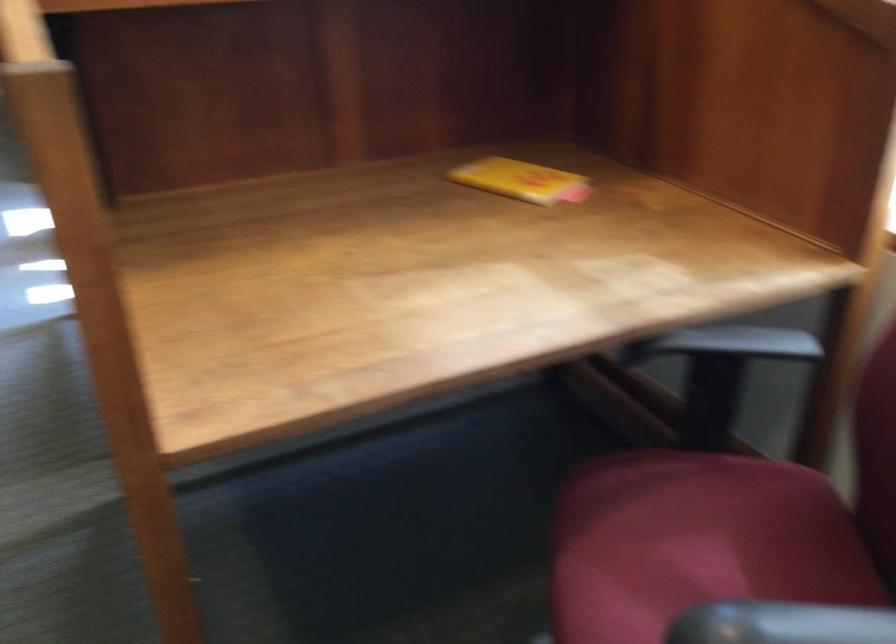
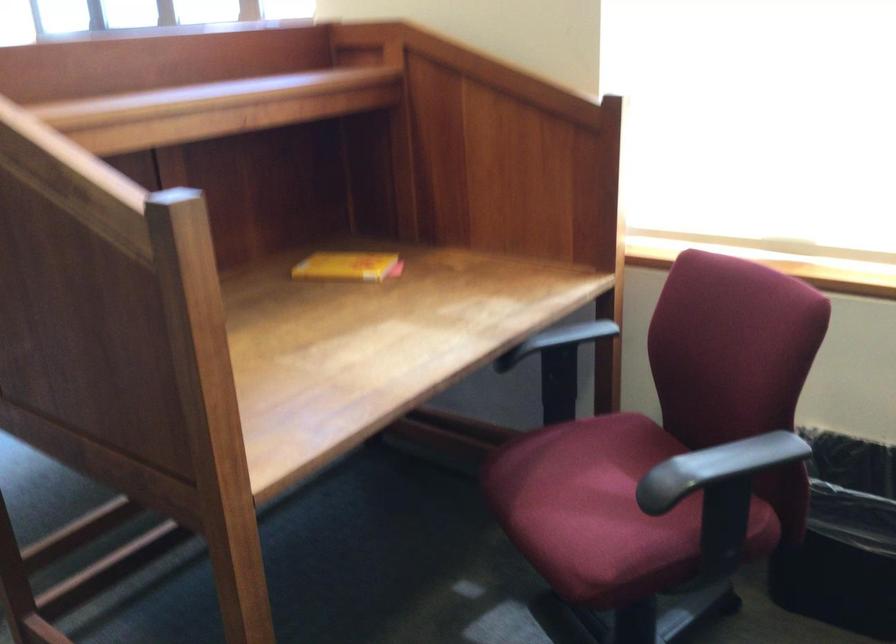
The point at (709,339) is marked in the first image. Where is the corresponding point in the second image?

(556, 339)